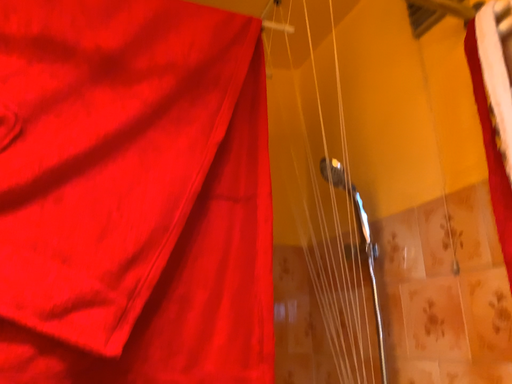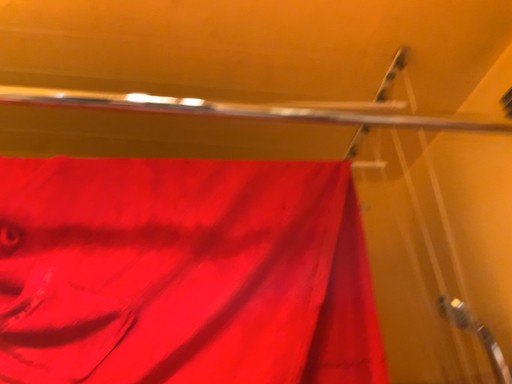
Question: Which way did the camera rotate in the video?

Choices:
 (A) rotated upward
 (B) rotated downward

Answer: (A)